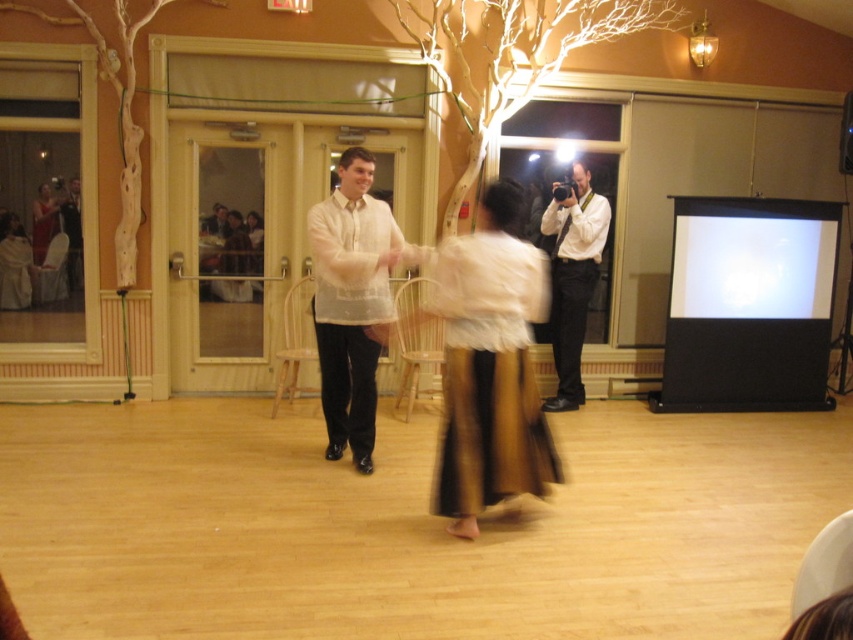
Question: Which of the following is the farthest from the observer?

Choices:
 (A) matte gold skirt at center
 (B) white sheer shirt at center

Answer: (A)

Question: Is white glossy shirt at upper right bigger than matte gold skirt at center?

Choices:
 (A) no
 (B) yes

Answer: (B)

Question: Can you confirm if white glossy projection screen at upper right is positioned below matte gold skirt at center?

Choices:
 (A) yes
 (B) no

Answer: (A)

Question: Is white glossy shirt at upper right further to camera compared to matte gold skirt at center?

Choices:
 (A) no
 (B) yes

Answer: (B)

Question: Based on their relative distances, which object is nearer to the white glossy shirt at upper right?

Choices:
 (A) gold shimmering skirt at center
 (B) matte gold skirt at center
 (C) white sheer shirt at center

Answer: (C)

Question: Estimate the real-world distances between objects in this image. Which object is farther from the white sheer shirt at center?

Choices:
 (A) matte gold skirt at center
 (B) gold metallic skirt at center
 (C) gold shimmering skirt at center
 (D) white glossy projection screen at upper right

Answer: (D)